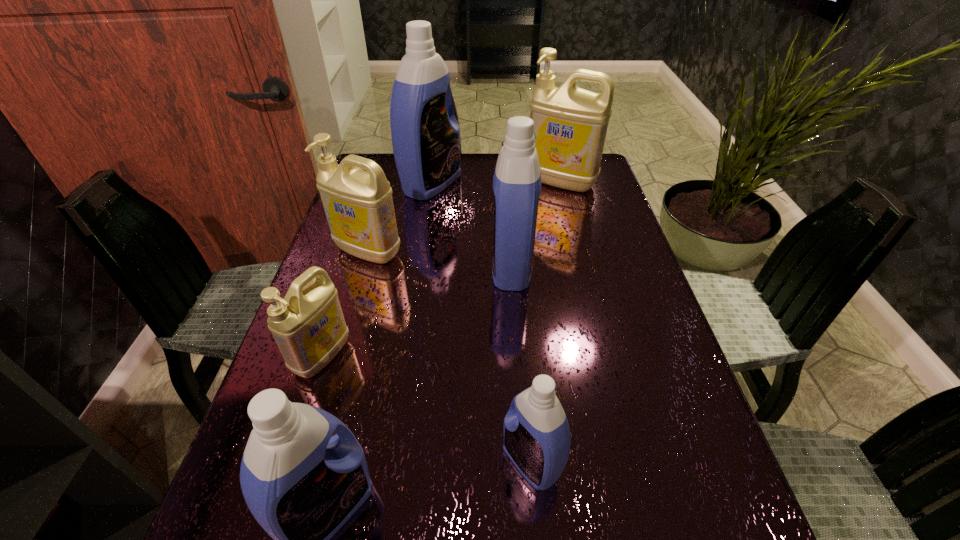
The width and height of the screenshot is (960, 540). I want to click on the second closest detergent to the smallest blue detergent, so click(308, 325).

I want to click on blue detergent that stands as the closest to the nearest beige detergent, so click(x=301, y=485).

I want to click on blue detergent that stands as the fourth closest to the second nearest beige detergent, so click(x=537, y=439).

Identify which beige detergent is located as the nearest to the second smallest blue detergent. Please provide its 2D coordinates. Your answer should be formatted as a tuple, i.e. [(x, y)], where the tuple contains the x and y coordinates of a point satisfying the conditions above.

[(308, 325)]

You are a GUI agent. You are given a task and a screenshot of the screen. Output one action in this format:
    pyautogui.click(x=<x>, y=<y>)
    Task: Click on the closest beige detergent relative to the second farthest blue detergent
    This screenshot has width=960, height=540.
    Given the screenshot: What is the action you would take?
    pyautogui.click(x=570, y=123)

At what (x,y) coordinates should I click in order to perform the action: click on vacant space that satisfies the following two spatial constraints: 1. on the back side of the smallest beige detergent; 2. on the right side of the biggest blue detergent. Please return your answer as a coordinate pair (x, y). The width and height of the screenshot is (960, 540). Looking at the image, I should click on (377, 184).